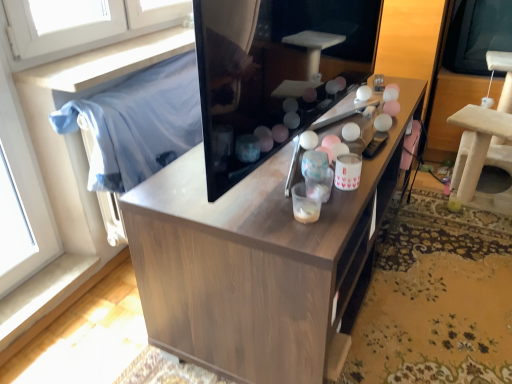
Question: Are wooden cabinet at center and beige carpeted cat tree at right beside each other?

Choices:
 (A) no
 (B) yes

Answer: (A)

Question: From a real-world perspective, is wooden cabinet at center positioned under beige carpeted cat tree at right based on gravity?

Choices:
 (A) no
 (B) yes

Answer: (B)

Question: Does wooden cabinet at center have a larger size compared to beige carpeted cat tree at right?

Choices:
 (A) yes
 (B) no

Answer: (A)

Question: Is wooden cabinet at center not close to beige carpeted cat tree at right?

Choices:
 (A) yes
 (B) no

Answer: (A)

Question: From the image's perspective, is wooden cabinet at center above beige carpeted cat tree at right?

Choices:
 (A) no
 (B) yes

Answer: (A)

Question: Which is correct: transparent plastic window screen at upper right is inside blue fabric at left, or outside of it?

Choices:
 (A) outside
 (B) inside

Answer: (A)

Question: From a real-world perspective, is transparent plastic window screen at upper right above or below blue fabric at left?

Choices:
 (A) above
 (B) below

Answer: (A)

Question: Does point (450, 36) appear closer or farther from the camera than point (154, 125)?

Choices:
 (A) farther
 (B) closer

Answer: (A)

Question: Considering the positions of transparent plastic window screen at upper right and blue fabric at left in the image, is transparent plastic window screen at upper right wider or thinner than blue fabric at left?

Choices:
 (A) thin
 (B) wide

Answer: (B)

Question: Is point (458, 14) positioned closer to the camera than point (503, 87)?

Choices:
 (A) closer
 (B) farther

Answer: (B)

Question: From the image's perspective, is transparent plastic window screen at upper right located above or below beige carpeted cat tree at right?

Choices:
 (A) above
 (B) below

Answer: (A)

Question: Visually, is transparent plastic window screen at upper right positioned to the left or to the right of beige carpeted cat tree at right?

Choices:
 (A) left
 (B) right

Answer: (B)

Question: From a real-world perspective, is transparent plastic window screen at upper right above or below beige carpeted cat tree at right?

Choices:
 (A) below
 (B) above

Answer: (B)

Question: Considering the positions of wooden cabinet at center and transparent plastic window screen at upper right in the image, is wooden cabinet at center taller or shorter than transparent plastic window screen at upper right?

Choices:
 (A) tall
 (B) short

Answer: (A)

Question: Which is correct: wooden cabinet at center is inside transparent plastic window screen at upper right, or outside of it?

Choices:
 (A) inside
 (B) outside

Answer: (B)